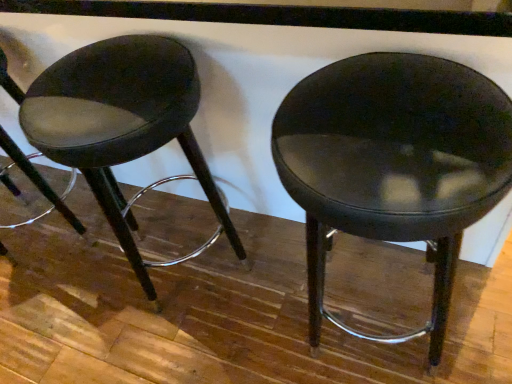
What do you see at coordinates (121, 121) in the screenshot?
I see `matte black stool at left` at bounding box center [121, 121].

I want to click on matte black stool at left, so click(x=121, y=121).

What do you see at coordinates (393, 164) in the screenshot?
I see `matte black stool at center` at bounding box center [393, 164].

Find the location of a particular element. The width and height of the screenshot is (512, 384). matte black stool at center is located at coordinates (393, 164).

Locate an element on the screen. matte black stool at left is located at coordinates (121, 121).

Which is more to the right, matte black stool at left or matte black stool at center?

From the viewer's perspective, matte black stool at center appears more on the right side.

Is the depth of matte black stool at left greater than that of matte black stool at center?

Yes, it is behind matte black stool at center.

Is point (112, 114) closer or farther from the camera than point (508, 174)?

Point (112, 114).

From the image's perspective, which is below, matte black stool at left or matte black stool at center?

From the image's view, matte black stool at center is below.

From a real-world perspective, does matte black stool at left stand above matte black stool at center?

No, from a real-world perspective, matte black stool at left is not over matte black stool at center

Does matte black stool at left have a lesser width compared to matte black stool at center?

Yes.

Between matte black stool at left and matte black stool at center, which one has more height?

matte black stool at center.

Considering the sizes of objects matte black stool at left and matte black stool at center in the image provided, who is bigger, matte black stool at left or matte black stool at center?

matte black stool at center.

Is matte black stool at left inside or outside of matte black stool at center?

matte black stool at left is not inside matte black stool at center, it's outside.

Would you say matte black stool at left is a long distance from matte black stool at center?

They are positioned close to each other.

Could you tell me if matte black stool at left is turned towards matte black stool at center?

No, matte black stool at left is not facing towards matte black stool at center.

What's the angular difference between matte black stool at left and matte black stool at center's facing directions?

They differ by 2.51e-05 degrees in their facing directions.

Measure the distance between matte black stool at left and matte black stool at center.

matte black stool at left and matte black stool at center are 41.02 centimeters apart.

Identify the location of stool that is on the left side of matte black stool at center. (121, 121).

Does matte black stool at center appear on the left side of matte black stool at left?

In fact, matte black stool at center is to the right of matte black stool at left.

Is matte black stool at center closer to camera compared to matte black stool at left?

Yes, matte black stool at center is in front of matte black stool at left.

Considering the positions of point (323, 285) and point (113, 147), is point (323, 285) closer or farther from the camera than point (113, 147)?

Point (323, 285) appears to be farther away from the viewer than point (113, 147).

From the image's perspective, which is below, matte black stool at center or matte black stool at left?

matte black stool at center appears lower in the image.

From a real-world perspective, which is physically below, matte black stool at center or matte black stool at left?

matte black stool at left, from a real-world perspective.

Does matte black stool at center have a lesser width compared to matte black stool at left?

No, matte black stool at center is not thinner than matte black stool at left.

Looking at this image, is matte black stool at center shorter than matte black stool at left?

No.

Based on their sizes in the image, would you say matte black stool at center is bigger or smaller than matte black stool at left?

Clearly, matte black stool at center is larger in size than matte black stool at left.

Consider the image. Would you say matte black stool at center is outside matte black stool at left?

Indeed, matte black stool at center is completely outside matte black stool at left.

Is matte black stool at center next to matte black stool at left and touching it?

No, matte black stool at center is not beside matte black stool at left.

Could you tell me if matte black stool at center is turned towards matte black stool at left?

No, matte black stool at center is not aimed at matte black stool at left.

How many degrees apart are the facing directions of matte black stool at center and matte black stool at left?

There is a 2.51e-05-degree angle between the facing directions of matte black stool at center and matte black stool at left.

Image resolution: width=512 pixels, height=384 pixels. I want to click on chair located in front of the matte black stool at left, so click(x=393, y=164).

Where is `chair that is above the matte black stool at left (from a real-world perspective)`? The height and width of the screenshot is (384, 512). chair that is above the matte black stool at left (from a real-world perspective) is located at coordinates (393, 164).

Image resolution: width=512 pixels, height=384 pixels. Identify the location of stool beneath the matte black stool at center (from a real-world perspective). (121, 121).